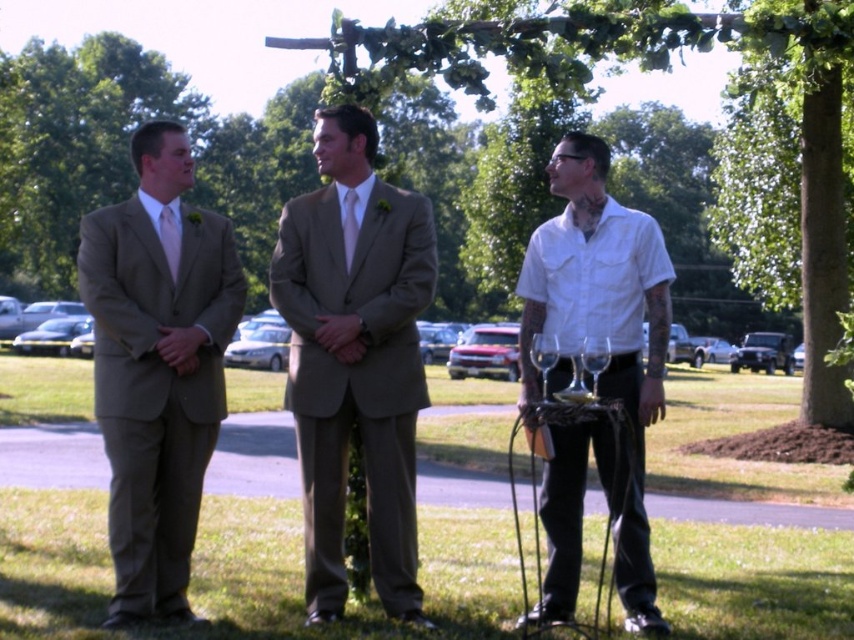
You are a photographer at a wedding ceremony. You need to position yourself so that both the matte brown suit at center and the matte brown suit at left are in frame. Considering their heights, which one will appear larger in your photo?

The matte brown suit at center appears larger in the photo because it is much taller than the matte brown suit at left.

You are a photographer at a wedding ceremony. You need to adjust the lighting to ensure both the matte brown suit at center and the matte pink tie at center are well lit. Based on their positions, which object is closer to the ground and might need more downward lighting?

The matte brown suit at center is positioned under the matte pink tie at center, so the matte brown suit at center is closer to the ground and might need more downward lighting.